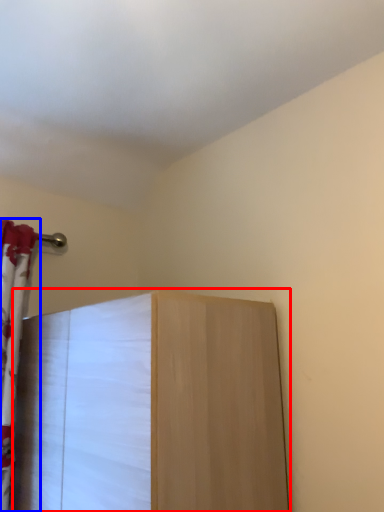
Question: Which of the following is the farthest to the observer, furniture (highlighted by a red box) or curtain (highlighted by a blue box)?

Choices:
 (A) furniture
 (B) curtain

Answer: (B)